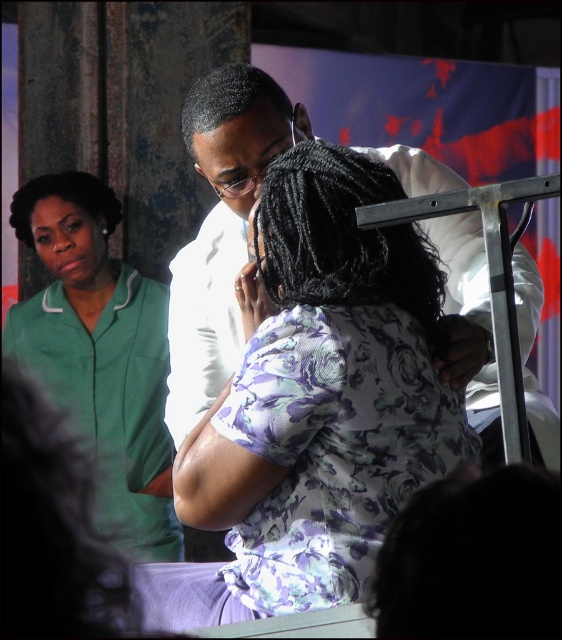
Question: Which is farther from the floral fabric blouse at center?

Choices:
 (A) white smooth shirt at center
 (B) green uniform at left

Answer: (B)

Question: Is floral fabric blouse at center further to the viewer compared to white smooth shirt at center?

Choices:
 (A) no
 (B) yes

Answer: (A)

Question: Does white smooth shirt at center have a greater width compared to green uniform at left?

Choices:
 (A) yes
 (B) no

Answer: (A)

Question: Does floral fabric blouse at center have a lesser width compared to white smooth shirt at center?

Choices:
 (A) yes
 (B) no

Answer: (A)

Question: Which of the following is the closest to the observer?

Choices:
 (A) green uniform at left
 (B) white smooth shirt at center

Answer: (B)

Question: Which point is farther to the camera?

Choices:
 (A) pos(428,182)
 (B) pos(83,230)

Answer: (B)